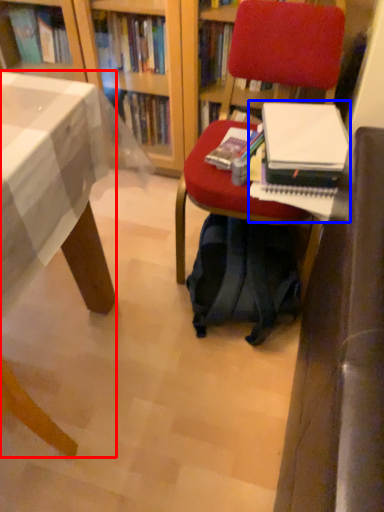
Question: Among these objects, which one is nearest to the camera, desk (highlighted by a red box) or paperback book (highlighted by a blue box)?

Choices:
 (A) desk
 (B) paperback book

Answer: (A)